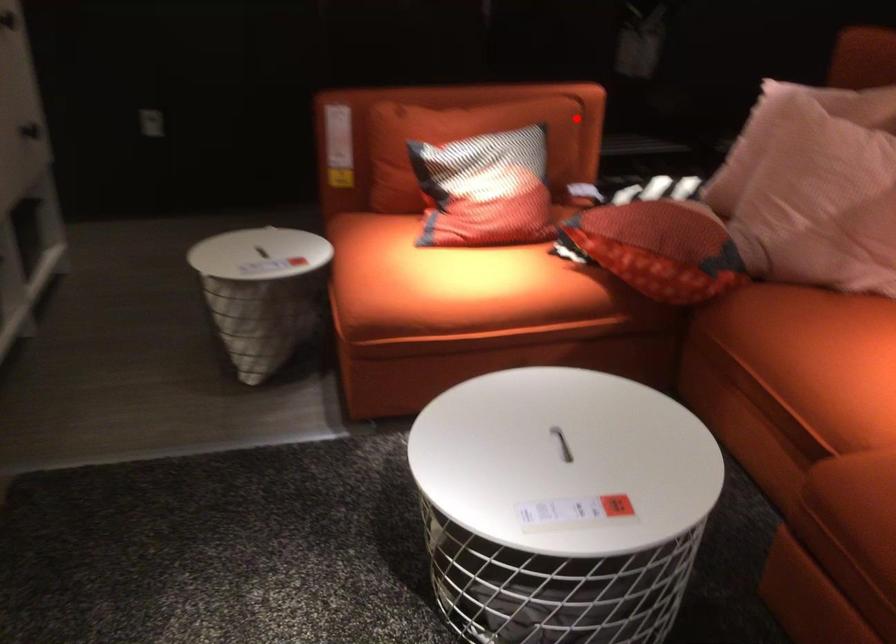
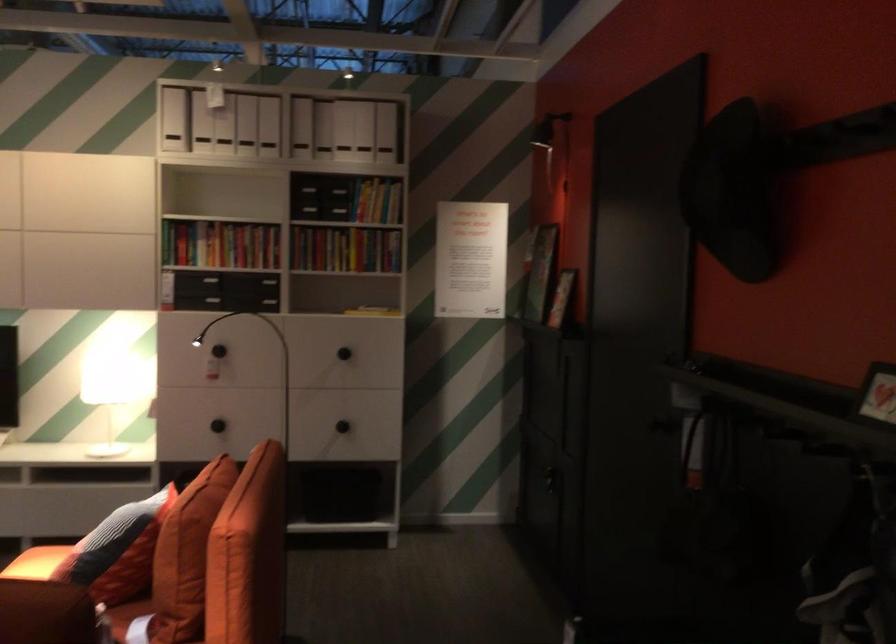
Question: I am providing you with two images of the same scene from different viewpoints. Given a red point in image1, look at the same physical point in image2. Is it:

Choices:
 (A) Closer to the viewpoint
 (B) Farther from the viewpoint

Answer: (A)